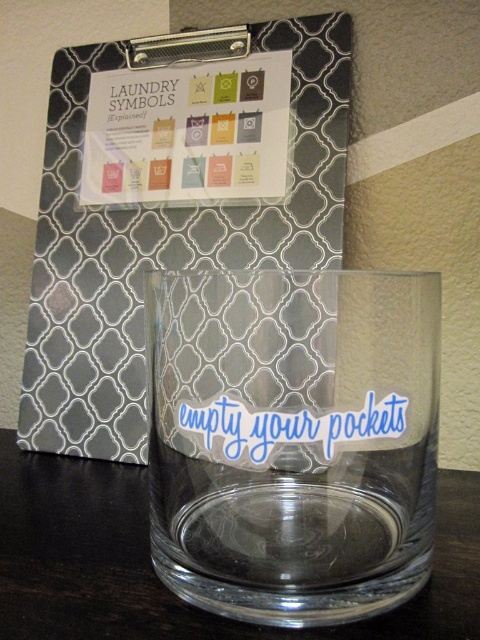
Question: Which point is closer to the camera taking this photo?

Choices:
 (A) (262, 211)
 (B) (360, 492)

Answer: (B)

Question: Does transparent plastic clipboard at upper left appear under transparent glass at lower center?

Choices:
 (A) no
 (B) yes

Answer: (A)

Question: Which point appears closest to the camera in this image?

Choices:
 (A) (307, 116)
 (B) (190, 540)
 (C) (64, 592)

Answer: (B)

Question: Which point appears farthest from the camera in this image?

Choices:
 (A) (196, 225)
 (B) (365, 467)

Answer: (A)

Question: Observing the image, what is the correct spatial positioning of transparent glass at center in reference to transparent glass at lower center?

Choices:
 (A) above
 (B) below

Answer: (A)

Question: Does transparent glass at center lie behind transparent glass at lower center?

Choices:
 (A) yes
 (B) no

Answer: (A)